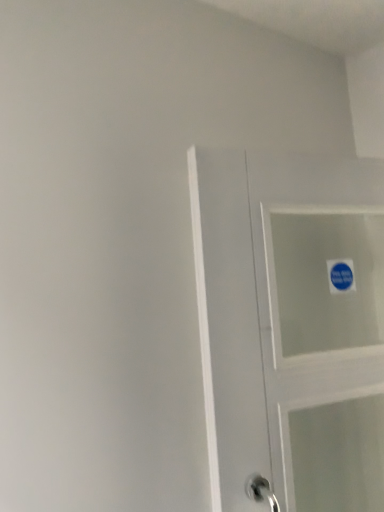
The image size is (384, 512). Describe the element at coordinates (341, 276) in the screenshot. I see `blue paper sticker at upper right` at that location.

Where is `blue paper sticker at upper right`? This screenshot has height=512, width=384. blue paper sticker at upper right is located at coordinates (341, 276).

Measure the distance between point (x=264, y=256) and camera.

The depth of point (x=264, y=256) is 36.46 inches.

Image resolution: width=384 pixels, height=512 pixels. Find the location of `white glossy door at center`. white glossy door at center is located at coordinates (320, 330).

What do you see at coordinates (320, 330) in the screenshot? I see `white glossy door at center` at bounding box center [320, 330].

Identify the location of blue paper sticker at upper right. (341, 276).

Which object is positioned more to the right, blue paper sticker at upper right or white glossy door at center?

From the viewer's perspective, blue paper sticker at upper right appears more on the right side.

Between blue paper sticker at upper right and white glossy door at center, which one is positioned behind?

Positioned behind is blue paper sticker at upper right.

Considering the points (346, 291) and (323, 340), which point is behind, point (346, 291) or point (323, 340)?

Positioned behind is point (346, 291).

From the image's perspective, is blue paper sticker at upper right on white glossy door at center?

Indeed, from the image's perspective, blue paper sticker at upper right is shown above white glossy door at center.

From a real-world perspective, relative to white glossy door at center, is blue paper sticker at upper right vertically above or below?

From a real-world perspective, blue paper sticker at upper right is physically above white glossy door at center.

Which object is thinner, blue paper sticker at upper right or white glossy door at center?

blue paper sticker at upper right is thinner.

Considering the relative sizes of blue paper sticker at upper right and white glossy door at center in the image provided, is blue paper sticker at upper right taller than white glossy door at center?

Incorrect, the height of blue paper sticker at upper right is not larger of that of white glossy door at center.

Does blue paper sticker at upper right have a larger size compared to white glossy door at center?

No, blue paper sticker at upper right is not bigger than white glossy door at center.

Is blue paper sticker at upper right inside the boundaries of white glossy door at center, or outside?

blue paper sticker at upper right is located inside white glossy door at center.

Are blue paper sticker at upper right and white glossy door at center beside each other?

No, blue paper sticker at upper right is not making contact with white glossy door at center.

Is blue paper sticker at upper right turned away from white glossy door at center?

Yes.

What's the angular difference between blue paper sticker at upper right and white glossy door at center's facing directions?

1.6 degrees separate the facing orientations of blue paper sticker at upper right and white glossy door at center.

How distant is blue paper sticker at upper right from white glossy door at center?

blue paper sticker at upper right and white glossy door at center are 23.74 centimeters apart from each other.

Find the location of a particular element. The width and height of the screenshot is (384, 512). door lying in front of the blue paper sticker at upper right is located at coordinates (320, 330).

Which is more to the left, white glossy door at center or blue paper sticker at upper right?

Positioned to the left is white glossy door at center.

Is the position of white glossy door at center less distant than that of blue paper sticker at upper right?

Yes, the depth of white glossy door at center is less than that of blue paper sticker at upper right.

Considering the points (299, 194) and (334, 283), which point is in front, point (299, 194) or point (334, 283)?

The point (299, 194) is in front.

From the image's perspective, is white glossy door at center located above blue paper sticker at upper right?

No, from the image's perspective, white glossy door at center is not over blue paper sticker at upper right.

From a real-world perspective, between white glossy door at center and blue paper sticker at upper right, who is vertically lower?

white glossy door at center is physically lower.

Considering the relative sizes of white glossy door at center and blue paper sticker at upper right in the image provided, is white glossy door at center wider than blue paper sticker at upper right?

Correct, the width of white glossy door at center exceeds that of blue paper sticker at upper right.

Which of these two, white glossy door at center or blue paper sticker at upper right, stands shorter?

blue paper sticker at upper right.

Looking at this image, in terms of size, does white glossy door at center appear bigger or smaller than blue paper sticker at upper right?

Clearly, white glossy door at center is larger in size than blue paper sticker at upper right.

Could blue paper sticker at upper right be considered to be inside white glossy door at center?

Yes, blue paper sticker at upper right can be found within white glossy door at center.

Can you see white glossy door at center touching blue paper sticker at upper right?

white glossy door at center and blue paper sticker at upper right are clearly separated.

Could you tell me if white glossy door at center is facing blue paper sticker at upper right?

Yes, white glossy door at center is turned towards blue paper sticker at upper right.

Locate an element on the screen. Image resolution: width=384 pixels, height=512 pixels. sticker located above the white glossy door at center (from a real-world perspective) is located at coordinates point(341,276).

Identify the location of sticker above the white glossy door at center (from a real-world perspective). (341, 276).

You are a GUI agent. You are given a task and a screenshot of the screen. Output one action in this format:
    pyautogui.click(x=<x>, y=<y>)
    Task: Click on the door that appears below the blue paper sticker at upper right (from the image's perspective)
    Image resolution: width=384 pixels, height=512 pixels.
    Given the screenshot: What is the action you would take?
    pyautogui.click(x=320, y=330)